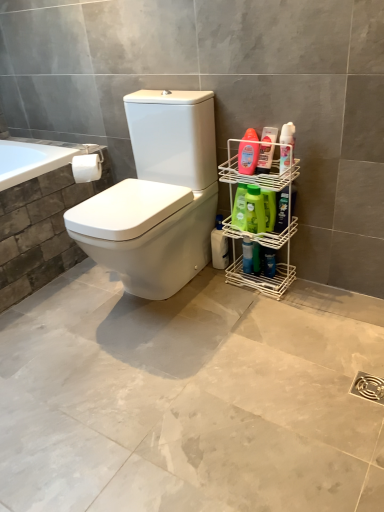
Question: Could blue glossy spray bottle at right, positioned as the first cleaning product in back-to-front order, be considered to be inside green matte bottle at right, marked as the 5th cleaning product in a front-to-back arrangement?

Choices:
 (A) no
 (B) yes

Answer: (A)

Question: Are green matte bottle at right, which is counted as the fourth cleaning product, starting from the back, and blue glossy spray bottle at right, positioned as the first cleaning product in back-to-front order, located far from each other?

Choices:
 (A) yes
 (B) no

Answer: (B)

Question: From a real-world perspective, does green matte bottle at right, marked as the 5th cleaning product in a front-to-back arrangement, stand above blue glossy spray bottle at right, positioned as the first cleaning product in back-to-front order?

Choices:
 (A) no
 (B) yes

Answer: (B)

Question: Would you say green matte bottle at right, which is counted as the fourth cleaning product, starting from the back, is outside blue glossy spray bottle at right, positioned as the first cleaning product in back-to-front order?

Choices:
 (A) yes
 (B) no

Answer: (A)

Question: Is the depth of green matte bottle at right, marked as the 5th cleaning product in a front-to-back arrangement, greater than that of blue glossy spray bottle at right, the eighth cleaning product in the front-to-back sequence?

Choices:
 (A) yes
 (B) no

Answer: (B)

Question: From a real-world perspective, relative to blue glossy bottle at lower right, is translucent plastic bottle at right, which is the 6th cleaning product from back to front, vertically above or below?

Choices:
 (A) below
 (B) above

Answer: (B)

Question: Is translucent plastic bottle at right, arranged as the 3th cleaning product when viewed from the front, to the left or to the right of blue glossy bottle at lower right in the image?

Choices:
 (A) right
 (B) left

Answer: (B)

Question: Looking at the image, does translucent plastic bottle at right, which is the 6th cleaning product from back to front, seem bigger or smaller compared to blue glossy bottle at lower right?

Choices:
 (A) big
 (B) small

Answer: (A)

Question: Is translucent plastic bottle at right, which is the 6th cleaning product from back to front, taller or shorter than blue glossy bottle at lower right?

Choices:
 (A) short
 (B) tall

Answer: (B)

Question: Considering the positions of point (274, 128) and point (238, 146), is point (274, 128) closer or farther from the camera than point (238, 146)?

Choices:
 (A) closer
 (B) farther

Answer: (A)

Question: Considering the positions of translucent plastic bottle at right, positioned as the 2th cleaning product in front-to-back order, and translucent plastic bottle at right, which is the 6th cleaning product from back to front, in the image, is translucent plastic bottle at right, positioned as the 2th cleaning product in front-to-back order, wider or thinner than translucent plastic bottle at right, which is the 6th cleaning product from back to front,?

Choices:
 (A) wide
 (B) thin

Answer: (A)

Question: Looking at the image, does translucent plastic bottle at right, the 7th cleaning product from the back, seem bigger or smaller compared to translucent plastic bottle at right, arranged as the 3th cleaning product when viewed from the front?

Choices:
 (A) small
 (B) big

Answer: (A)

Question: From the image's perspective, is translucent plastic bottle at right, positioned as the 2th cleaning product in front-to-back order, above or below translucent plastic bottle at right, which is the 6th cleaning product from back to front?

Choices:
 (A) above
 (B) below

Answer: (B)

Question: From a real-world perspective, relative to white matte toilet paper at upper left, is white plastic bottle at lower right, the 7th cleaning product when ordered from front to back, vertically above or below?

Choices:
 (A) above
 (B) below

Answer: (B)

Question: Is white plastic bottle at lower right, the second cleaning product when ordered from back to front, situated inside white matte toilet paper at upper left or outside?

Choices:
 (A) inside
 (B) outside

Answer: (B)